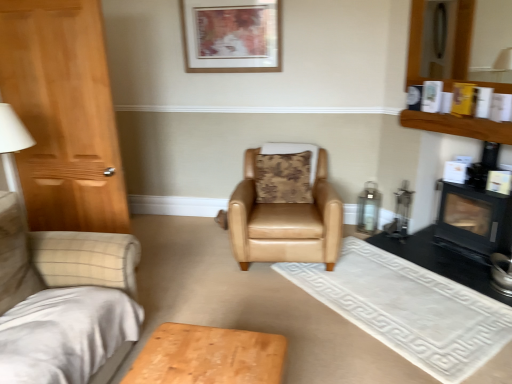
Where is `tan leather armchair at center`? The image size is (512, 384). tan leather armchair at center is located at coordinates (285, 210).

The image size is (512, 384). What do you see at coordinates (283, 178) in the screenshot?
I see `camouflage fabric pillow at center` at bounding box center [283, 178].

Measure the distance between wooden picture frame at upper center and camera.

The depth of wooden picture frame at upper center is 3.56 meters.

Image resolution: width=512 pixels, height=384 pixels. What are the coordinates of `tan leather armchair at center` in the screenshot? It's located at (285, 210).

Is wooden picture frame at upper center in front of black matte fireplace at right?

That is False.

In the image, is wooden picture frame at upper center on the left side or the right side of black matte fireplace at right?

wooden picture frame at upper center is positioned on black matte fireplace at right's left side.

Considering the sizes of objects wooden picture frame at upper center and black matte fireplace at right in the image provided, who is wider, wooden picture frame at upper center or black matte fireplace at right?

Wider between the two is black matte fireplace at right.

How distant is wooden picture frame at upper center from black matte fireplace at right?

wooden picture frame at upper center and black matte fireplace at right are 2.14 meters apart.

Which object is wider, tan leather armchair at center or camouflage fabric pillow at center?

tan leather armchair at center is wider.

Does tan leather armchair at center appear on the right side of camouflage fabric pillow at center?

No.

Could camouflage fabric pillow at center be considered to be inside tan leather armchair at center?

Yes.

Is camouflage fabric pillow at center with wooden shelf at upper right?

No, camouflage fabric pillow at center is not next to wooden shelf at upper right.

Is wooden shelf at upper right located within camouflage fabric pillow at center?

No.

Could you tell me if camouflage fabric pillow at center is turned towards wooden shelf at upper right?

No, camouflage fabric pillow at center is not oriented towards wooden shelf at upper right.

Identify the location of shelf above the camouflage fabric pillow at center (from the image's perspective). (458, 126).

Do you think camouflage fabric pillow at center is within tan leather armchair at center, or outside of it?

The correct answer is: inside.

Visually, is camouflage fabric pillow at center positioned to the left or to the right of tan leather armchair at center?

Based on their positions, camouflage fabric pillow at center is located to the right of tan leather armchair at center.

Are camouflage fabric pillow at center and tan leather armchair at center far apart?

No, camouflage fabric pillow at center is not far from tan leather armchair at center.

Does point (264, 167) lie in front of point (291, 218)?

No, it is behind (291, 218).

Is tan leather armchair at center outside of wooden shelf at upper right?

Yes, tan leather armchair at center is not within wooden shelf at upper right.

Which object is further away from the camera taking this photo, tan leather armchair at center or wooden shelf at upper right?

tan leather armchair at center is further from the camera.

Between tan leather armchair at center and wooden shelf at upper right, which one appears on the right side from the viewer's perspective?

wooden shelf at upper right is more to the right.

Is camouflage fabric pillow at center facing towards black matte fireplace at right?

No.

From a real-world perspective, is camouflage fabric pillow at center above or below black matte fireplace at right?

Clearly, from a real-world perspective, camouflage fabric pillow at center is above black matte fireplace at right.

Is camouflage fabric pillow at center far from black matte fireplace at right?

Yes, camouflage fabric pillow at center and black matte fireplace at right are located far from each other.

From the image's perspective, does camouflage fabric pillow at center appear lower than black matte fireplace at right?

Incorrect, from the image's perspective, camouflage fabric pillow at center is higher than black matte fireplace at right.

From the picture: Considering the relative sizes of wooden picture frame at upper center and tan leather armchair at center in the image provided, is wooden picture frame at upper center wider than tan leather armchair at center?

No, wooden picture frame at upper center is not wider than tan leather armchair at center.

From a real-world perspective, is wooden picture frame at upper center physically located above or below tan leather armchair at center?

wooden picture frame at upper center is above tan leather armchair at center.

Find the location of a particular element. The width and height of the screenshot is (512, 384). chair that appears below the wooden picture frame at upper center (from a real-world perspective) is located at coordinates (285, 210).

At what (x,y) coordinates should I click in order to perform the action: click on fireplace located in front of the wooden picture frame at upper center. Please return your answer as a coordinate pair (x, y). This screenshot has height=384, width=512. Looking at the image, I should click on (473, 221).

You are a GUI agent. You are given a task and a screenshot of the screen. Output one action in this format:
    pyautogui.click(x=<x>, y=<y>)
    Task: Click on the pillow behind the tan leather armchair at center
    The image size is (512, 384).
    Given the screenshot: What is the action you would take?
    pyautogui.click(x=283, y=178)

When comparing their distances from wooden shelf at upper right, does camouflage fabric pillow at center or wooden picture frame at upper center seem further?

wooden picture frame at upper center.

Considering their positions, is wooden picture frame at upper center positioned further to wooden shelf at upper right than camouflage fabric pillow at center?

Based on the image, wooden picture frame at upper center appears to be further to wooden shelf at upper right.

When comparing their distances from wooden shelf at upper right, does black matte fireplace at right or camouflage fabric pillow at center seem further?

camouflage fabric pillow at center is positioned further to the anchor wooden shelf at upper right.

Estimate the real-world distances between objects in this image. Which object is further from tan leather armchair at center, camouflage fabric pillow at center or wooden picture frame at upper center?

wooden picture frame at upper center.

Based on the photo, looking at the image, which one is located further to wooden shelf at upper right, wooden picture frame at upper center or black matte fireplace at right?

Based on the image, wooden picture frame at upper center appears to be further to wooden shelf at upper right.

Looking at the image, which one is located further to camouflage fabric pillow at center, wooden shelf at upper right or black matte fireplace at right?

The object further to camouflage fabric pillow at center is black matte fireplace at right.

Which object lies further to the anchor point wooden picture frame at upper center, wooden shelf at upper right or camouflage fabric pillow at center?

wooden shelf at upper right.

From the image, which object appears to be farther from tan leather armchair at center, black matte fireplace at right or wooden shelf at upper right?

black matte fireplace at right lies further to tan leather armchair at center than the other object.

Locate an element on the screen. pillow between tan leather armchair at center and black matte fireplace at right from left to right is located at coordinates (283, 178).

You are a GUI agent. You are given a task and a screenshot of the screen. Output one action in this format:
    pyautogui.click(x=<x>, y=<y>)
    Task: Click on the pillow between tan leather armchair at center and wooden shelf at upper right in the horizontal direction
    
    Given the screenshot: What is the action you would take?
    pyautogui.click(x=283, y=178)

You are a GUI agent. You are given a task and a screenshot of the screen. Output one action in this format:
    pyautogui.click(x=<x>, y=<y>)
    Task: Click on the pillow located between wooden picture frame at upper center and black matte fireplace at right in the left-right direction
    The image size is (512, 384).
    Given the screenshot: What is the action you would take?
    pyautogui.click(x=283, y=178)

Locate an element on the screen. pillow between wooden picture frame at upper center and wooden shelf at upper right is located at coordinates (283, 178).